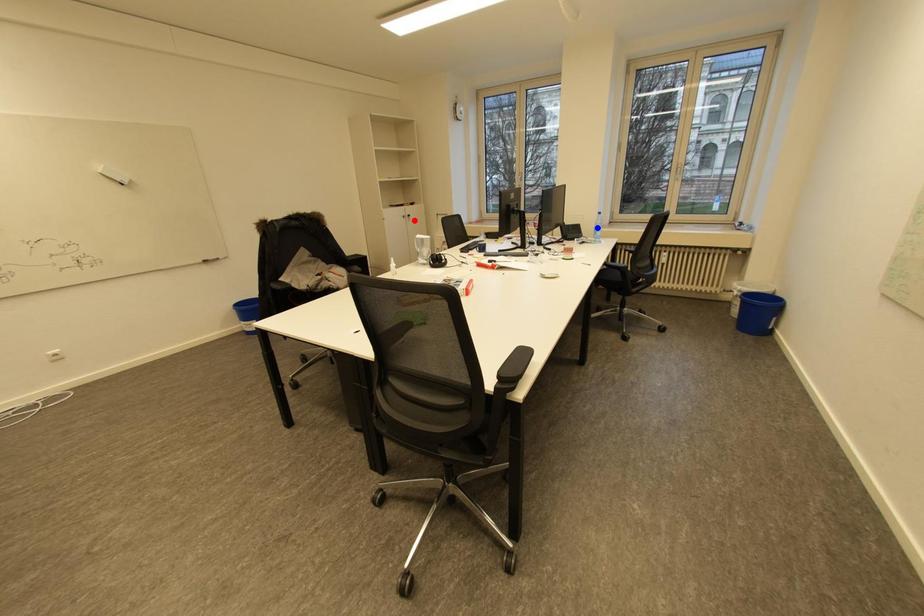
Question: Two points are marked on the image. Which point is closer to the camera?

Choices:
 (A) Blue point is closer.
 (B) Red point is closer.

Answer: (B)